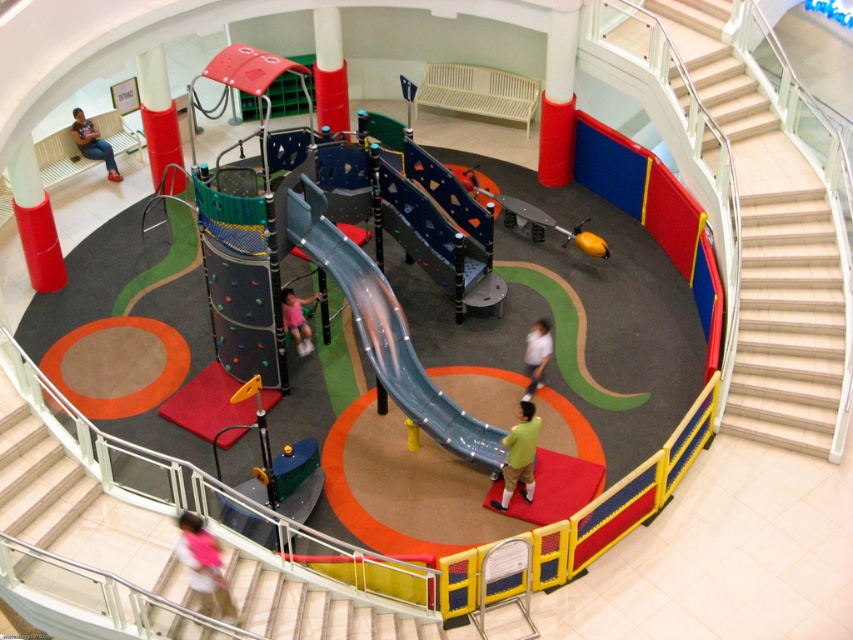
You are a parent trying to decide which area of the playground is safer for your child to play in. The green matte shirt at center and the pink fabric at center are both on the floor. Which one is wider and thus provides more space for safe play?

The green matte shirt at center might be wider than pink fabric at center, so it could provide more space for safe play.

You are standing at the entrance of the indoor playground and see two points marked on the floor. The first point is at coordinate point (511, 480) and the second is at point (543, 346). If you want to reach the point that is closer to you, which coordinate should you walk towards?

You should walk towards point (511, 480) because it is closer to you than point (543, 346).

You are a parent supervising children in the playground. You notice a green matte shirt at center and a pink fabric at center. Which clothing item is higher in position?

The green matte shirt at center is taller than the pink fabric at center.